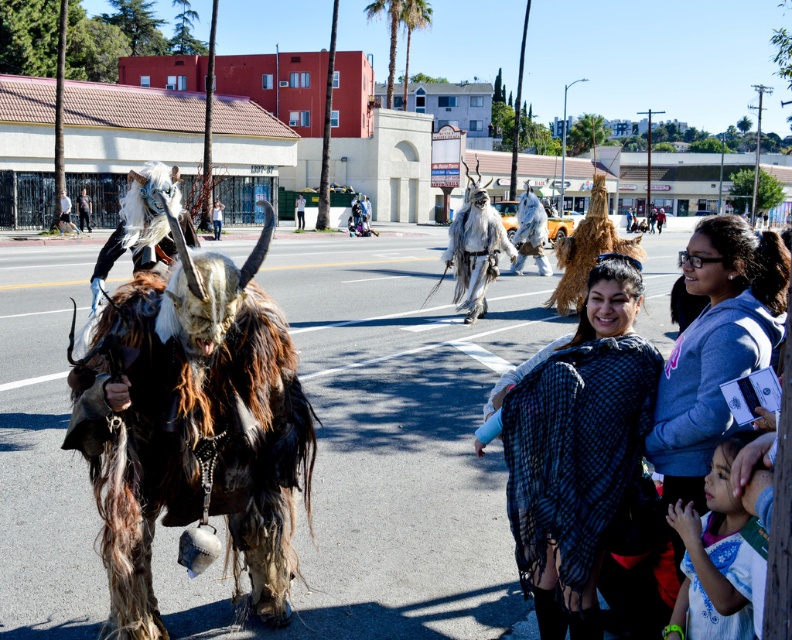
Can you confirm if black textured shawl at center is thinner than white cotton shirt at center?

No.

The height and width of the screenshot is (640, 792). Identify the location of black textured shawl at center. 577,449.

Is black textured shawl at center positioned at the back of smooth leather glove at center?

No.

Locate an element on the screen. The height and width of the screenshot is (640, 792). black textured shawl at center is located at coordinates (577, 449).

Does point (528, 374) come closer to viewer compared to point (82, 192)?

That is True.

This screenshot has height=640, width=792. What are the coordinates of `black textured shawl at center` in the screenshot? It's located at (577, 449).

Does white fur costume at lower right have a smaller size compared to white fur costume at center?

Correct, white fur costume at lower right occupies less space than white fur costume at center.

Measure the distance between point (701, 525) and camera.

They are 9.58 feet apart.

Locate an element on the screen. This screenshot has width=792, height=640. white fur costume at lower right is located at coordinates (729, 582).